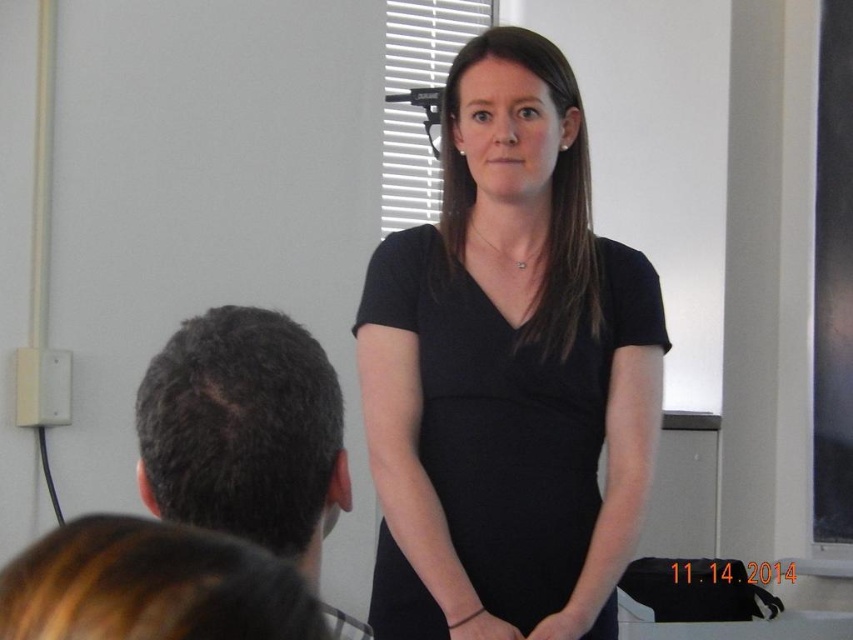
Can you confirm if black matte dress at center is taller than dark brown hair at left?

Yes, black matte dress at center is taller than dark brown hair at left.

Does black matte dress at center appear on the right side of dark brown hair at left?

Correct, you'll find black matte dress at center to the right of dark brown hair at left.

Where is `black matte dress at center`? black matte dress at center is located at coordinates (509, 413).